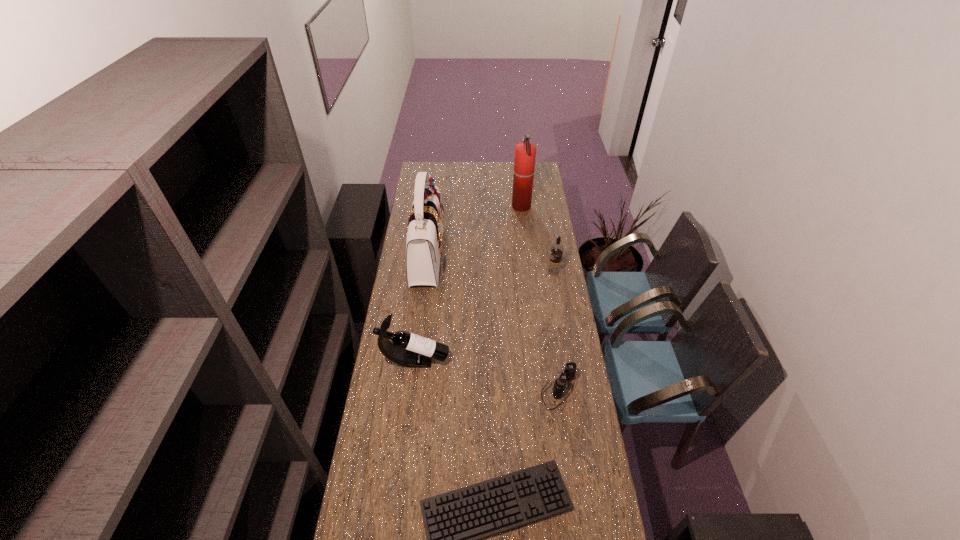
Locate an element on the screen. The height and width of the screenshot is (540, 960). binoculars present at the right edge is located at coordinates (569, 372).

In the image, there is a desktop. Where is `vacant space at the far edge`? This screenshot has height=540, width=960. vacant space at the far edge is located at coordinates (506, 180).

Where is `free space at the left edge of the desktop`? free space at the left edge of the desktop is located at coordinates (420, 301).

You are a GUI agent. You are given a task and a screenshot of the screen. Output one action in this format:
    pyautogui.click(x=<x>, y=<y>)
    Task: Click on the vacant space at the right edge of the desktop
    Image resolution: width=960 pixels, height=540 pixels.
    Given the screenshot: What is the action you would take?
    pyautogui.click(x=529, y=221)

Image resolution: width=960 pixels, height=540 pixels. Find the location of `free space that is in between the satchel and the vodka`. free space that is in between the satchel and the vodka is located at coordinates coord(491,264).

You are a GUI agent. You are given a task and a screenshot of the screen. Output one action in this format:
    pyautogui.click(x=<x>, y=<y>)
    Task: Click on the free area in between the satchel and the fifth farthest object
    
    Given the screenshot: What is the action you would take?
    pyautogui.click(x=493, y=323)

Identify the location of free space between the third tallest object and the binoculars. (487, 375).

Where is `vacant space that's between the satchel and the fire extinguisher`? vacant space that's between the satchel and the fire extinguisher is located at coordinates (474, 232).

The width and height of the screenshot is (960, 540). What are the coordinates of `vacant space that's between the fourth farthest object and the satchel` in the screenshot? It's located at (421, 308).

Where is `free space between the fourth shortest object and the third shortest object`? The height and width of the screenshot is (540, 960). free space between the fourth shortest object and the third shortest object is located at coordinates (485, 316).